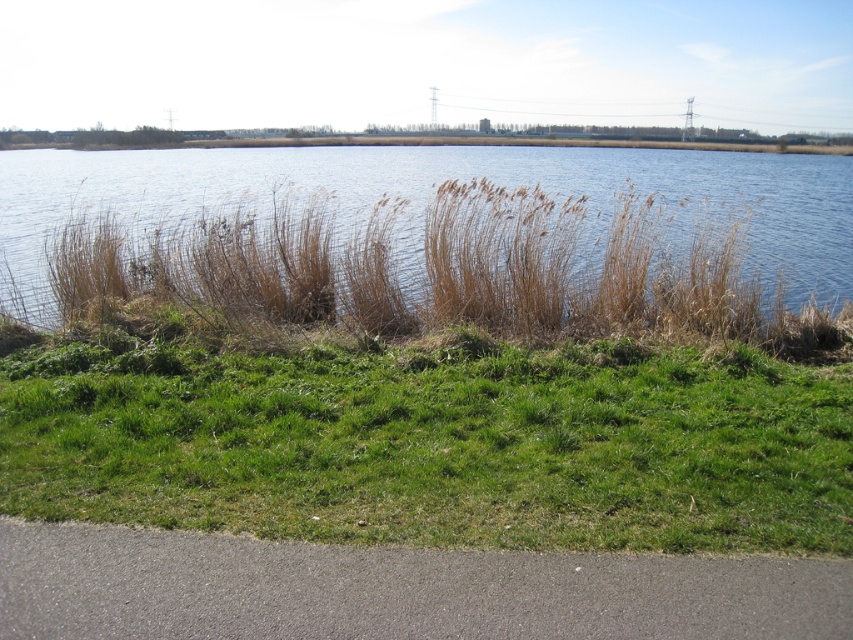
How much distance is there between brown grassy water at center and gray asphalt curb at lower left?

brown grassy water at center is 161.22 feet from gray asphalt curb at lower left.

Is brown grassy water at center bigger than gray asphalt curb at lower left?

Correct, brown grassy water at center is larger in size than gray asphalt curb at lower left.

Is point (691, 172) farther from camera compared to point (200, 538)?

Yes, point (691, 172) is behind point (200, 538).

Where is `brown grassy water at center`? The image size is (853, 640). brown grassy water at center is located at coordinates (433, 193).

Is green grass at lower center to the left of brown grassy water at center from the viewer's perspective?

Correct, you'll find green grass at lower center to the left of brown grassy water at center.

Which is above, green grass at lower center or brown grassy water at center?

brown grassy water at center is above.

Is point (274, 458) positioned in front of point (18, 196)?

Yes.

I want to click on green grass at lower center, so click(437, 444).

Is green grass at lower center smaller than gray asphalt curb at lower left?

No.

Who is higher up, green grass at lower center or gray asphalt curb at lower left?

green grass at lower center is higher up.

Who is more distant from viewer, (653, 458) or (20, 516)?

The point (653, 458) is behind.

Image resolution: width=853 pixels, height=640 pixels. Identify the location of green grass at lower center. (437, 444).